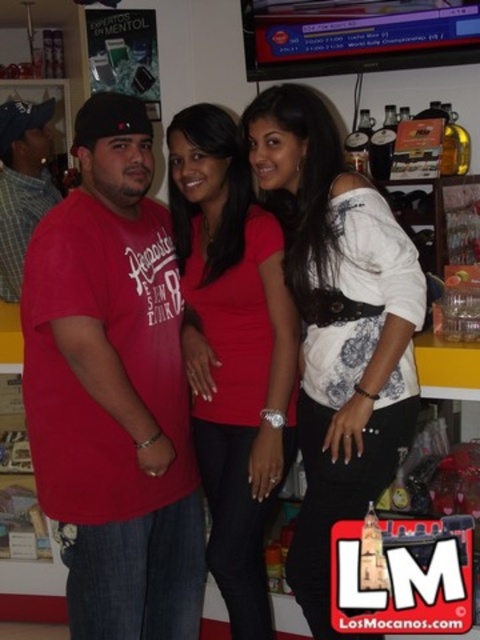
Question: Which point appears farthest from the camera in this image?

Choices:
 (A) (199, 324)
 (B) (47, 109)

Answer: (B)

Question: Is red cotton t-shirt at center below white matte shirt at center?

Choices:
 (A) no
 (B) yes

Answer: (B)

Question: Based on their relative distances, which object is farther from the matte red shirt at left?

Choices:
 (A) red cotton t-shirt at center
 (B) white matte shirt at center
 (C) matte red shirt at center

Answer: (B)

Question: Is matte red shirt at center smaller than matte red shirt at left?

Choices:
 (A) yes
 (B) no

Answer: (B)

Question: Is white matte shirt at center to the left of matte red shirt at center from the viewer's perspective?

Choices:
 (A) yes
 (B) no

Answer: (B)

Question: Which of the following is the closest to the observer?

Choices:
 (A) matte red shirt at left
 (B) white matte shirt at center
 (C) red cotton t-shirt at center

Answer: (C)